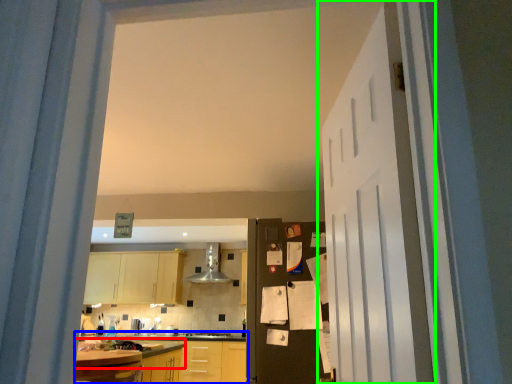
Question: Which object is positioned closest to countertop (highlighted by a red box)? Select from countertop (highlighted by a blue box) and door (highlighted by a green box).

Choices:
 (A) countertop
 (B) door

Answer: (A)